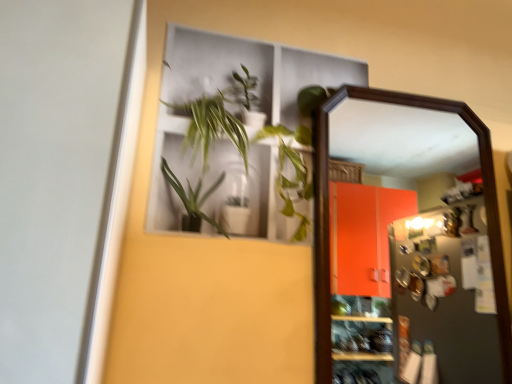
Question: Should I look upward or downward to see wooden-framed mirror at right?

Choices:
 (A) up
 (B) down

Answer: (B)